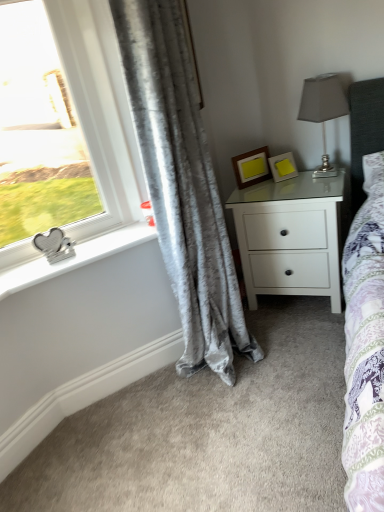
Question: In terms of height, does wooden picture frame at center, which is the first picture frame from left to right, look taller or shorter compared to white matte nightstand at center-right?

Choices:
 (A) tall
 (B) short

Answer: (B)

Question: Considering their positions, is wooden picture frame at center, which is the first picture frame from left to right, located in front of or behind white matte nightstand at center-right?

Choices:
 (A) front
 (B) behind

Answer: (B)

Question: Estimate the real-world distances between objects in this image. Which object is farther from the silver metallic heart-shaped object at left?

Choices:
 (A) wooden picture frame at center, which is counted as the second picture frame, starting from the right
 (B) yellow matte picture frame at upper right, the second picture frame positioned from the left
 (C) satin silver table lamp at upper right
 (D) velvet gray curtain at left
 (E) white plastic window at upper left

Answer: (C)

Question: Estimate the real-world distances between objects in this image. Which object is farther from the yellow matte picture frame at upper right, the first picture frame from the right?

Choices:
 (A) silver metallic heart-shaped object at left
 (B) satin silver table lamp at upper right
 (C) wooden picture frame at center, which is counted as the second picture frame, starting from the right
 (D) velvet gray curtain at left
 (E) white plastic window at upper left

Answer: (A)